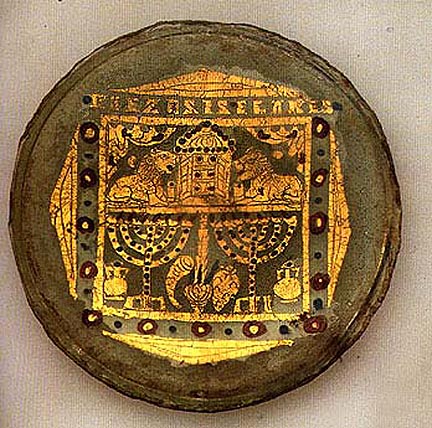
The image size is (432, 428). In order to click on flower vase in this screenshot , I will do `click(229, 284)`.